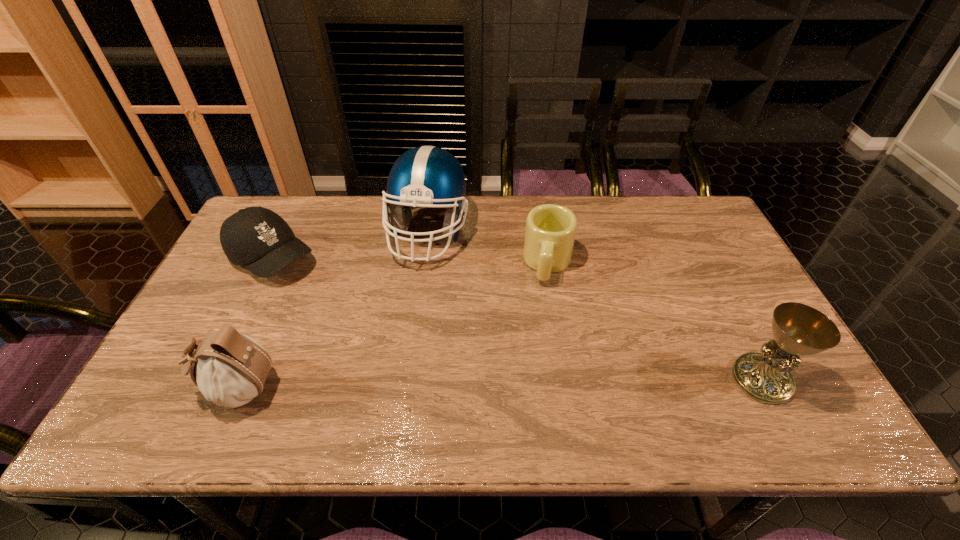
Where is `chalice present at the near edge`? The image size is (960, 540). chalice present at the near edge is located at coordinates (798, 329).

Where is `pouch at the left edge`? pouch at the left edge is located at coordinates (230, 369).

Find the location of a particular element. baseball cap positioned at the left edge is located at coordinates (255, 237).

You are a GUI agent. You are given a task and a screenshot of the screen. Output one action in this format:
    pyautogui.click(x=<x>, y=<y>)
    Task: Click on the object at the right edge
    This screenshot has height=540, width=960.
    Given the screenshot: What is the action you would take?
    pyautogui.click(x=798, y=329)

Where is `object located at the far left corner`? The image size is (960, 540). object located at the far left corner is located at coordinates (255, 237).

You are a GUI agent. You are given a task and a screenshot of the screen. Output one action in this format:
    pyautogui.click(x=<x>, y=<y>)
    Task: Click on the object at the near left corner
    This screenshot has width=960, height=540.
    Given the screenshot: What is the action you would take?
    pyautogui.click(x=230, y=369)

What are the coordinates of `object that is at the near right corner` in the screenshot? It's located at (798, 329).

Find the location of a particular element. The height and width of the screenshot is (540, 960). vacant space at the far edge of the desktop is located at coordinates (647, 236).

In the image, there is a desktop. At what (x,y) coordinates should I click in order to perform the action: click on free space at the near edge. Please return your answer as a coordinate pair (x, y). This screenshot has height=540, width=960. Looking at the image, I should click on [x=677, y=392].

Locate an element on the screen. The height and width of the screenshot is (540, 960). free space at the left edge of the desktop is located at coordinates (248, 318).